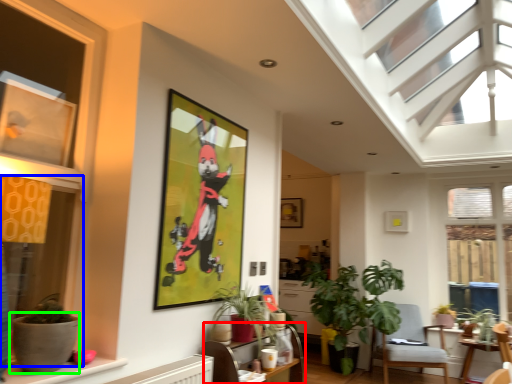
Question: Which object is the closest to the table (highlighted by a red box)? Choose among these: window (highlighted by a blue box) or flowerpot (highlighted by a green box).

Choices:
 (A) window
 (B) flowerpot

Answer: (B)